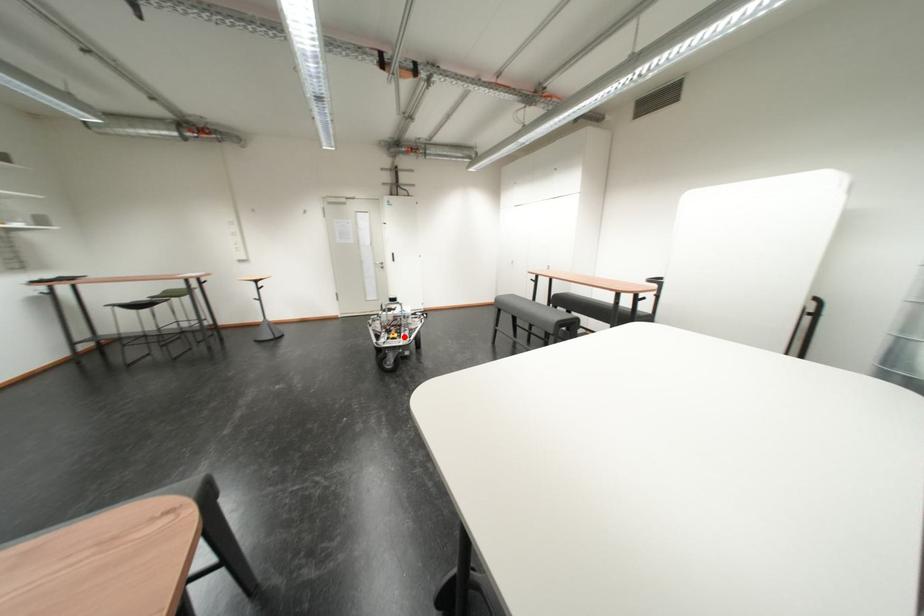
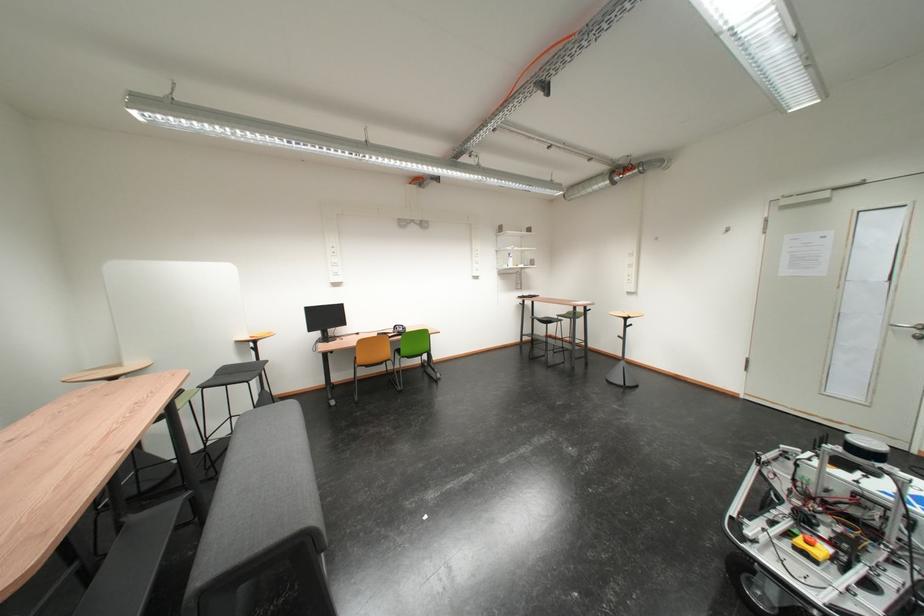
Locate, in the second image, the point that corresponds to the highlighted location in the first image.

(820, 545)